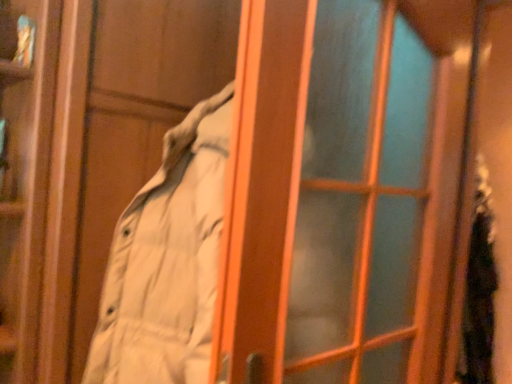
At what (x,y) coordinates should I click in order to perform the action: click on translucent glass screen door at center. Please return your answer as a coordinate pair (x, y). This screenshot has height=384, width=512. Looking at the image, I should click on (343, 190).

The width and height of the screenshot is (512, 384). Describe the element at coordinates (343, 190) in the screenshot. I see `translucent glass screen door at center` at that location.

The width and height of the screenshot is (512, 384). What do you see at coordinates (479, 290) in the screenshot?
I see `fuzzy black scarf at right` at bounding box center [479, 290].

Image resolution: width=512 pixels, height=384 pixels. Find the location of `fuzzy black scarf at right`. fuzzy black scarf at right is located at coordinates (479, 290).

What is the approximate width of fuzzy black scarf at right?

It is 6.08 inches.

Where is `translucent glass screen door at center`? translucent glass screen door at center is located at coordinates (343, 190).

Visually, is translucent glass screen door at center positioned to the left or to the right of fuzzy black scarf at right?

translucent glass screen door at center is to the left of fuzzy black scarf at right.

Is translucent glass screen door at center positioned before fuzzy black scarf at right?

Yes, it is in front of fuzzy black scarf at right.

Does point (360, 268) come behind point (469, 339)?

No, (360, 268) is closer to viewer.

From the image's perspective, which one is positioned higher, translucent glass screen door at center or fuzzy black scarf at right?

translucent glass screen door at center.

From a real-world perspective, between translucent glass screen door at center and fuzzy black scarf at right, who is vertically higher?

From a 3D spatial view, translucent glass screen door at center is above.

Considering the sizes of translucent glass screen door at center and fuzzy black scarf at right in the image, is translucent glass screen door at center wider or thinner than fuzzy black scarf at right?

Considering their sizes, translucent glass screen door at center looks slimmer than fuzzy black scarf at right.

From the picture: From their relative heights in the image, would you say translucent glass screen door at center is taller or shorter than fuzzy black scarf at right?

translucent glass screen door at center is shorter than fuzzy black scarf at right.

Is translucent glass screen door at center smaller than fuzzy black scarf at right?

No, translucent glass screen door at center is not smaller than fuzzy black scarf at right.

Would you say fuzzy black scarf at right is part of translucent glass screen door at center's contents?

No, fuzzy black scarf at right is located outside of translucent glass screen door at center.

Would you consider translucent glass screen door at center to be distant from fuzzy black scarf at right?

Yes.

Is translucent glass screen door at center looking in the opposite direction of fuzzy black scarf at right?

That's not correct — translucent glass screen door at center is not looking away from fuzzy black scarf at right.

How many degrees apart are the facing directions of translucent glass screen door at center and fuzzy black scarf at right?

The angle between the facing direction of translucent glass screen door at center and the facing direction of fuzzy black scarf at right is 87.7 degrees.

Locate an element on the screen. person below the translucent glass screen door at center (from the image's perspective) is located at coordinates (479, 290).

Can you confirm if fuzzy black scarf at right is positioned to the left of translucent glass screen door at center?

No, fuzzy black scarf at right is not to the left of translucent glass screen door at center.

Considering their positions, is fuzzy black scarf at right located in front of or behind translucent glass screen door at center?

fuzzy black scarf at right is behind translucent glass screen door at center.

Which is in front, point (461, 382) or point (293, 55)?

Positioned in front is point (293, 55).

From the image's perspective, which one is positioned lower, fuzzy black scarf at right or translucent glass screen door at center?

fuzzy black scarf at right appears lower in the image.

From a real-world perspective, is fuzzy black scarf at right located higher than translucent glass screen door at center?

No.

Does fuzzy black scarf at right have a lesser width compared to translucent glass screen door at center?

In fact, fuzzy black scarf at right might be wider than translucent glass screen door at center.

Looking at this image, in terms of height, does fuzzy black scarf at right look taller or shorter compared to translucent glass screen door at center?

fuzzy black scarf at right is taller than translucent glass screen door at center.

Which of these two, fuzzy black scarf at right or translucent glass screen door at center, is bigger?

translucent glass screen door at center is bigger.

Does fuzzy black scarf at right contain translucent glass screen door at center?

Definitely not — translucent glass screen door at center is not inside fuzzy black scarf at right.

Is fuzzy black scarf at right not close to translucent glass screen door at center?

Yes, fuzzy black scarf at right and translucent glass screen door at center are quite far apart.

Could you tell me if fuzzy black scarf at right is facing translucent glass screen door at center?

No, fuzzy black scarf at right is not facing towards translucent glass screen door at center.

I want to click on screen door above the fuzzy black scarf at right (from the image's perspective), so click(343, 190).

Locate an element on the screen. Image resolution: width=512 pixels, height=384 pixels. person that is behind the translucent glass screen door at center is located at coordinates (479, 290).

Find the location of a particular element. The image size is (512, 384). screen door on the left of fuzzy black scarf at right is located at coordinates (343, 190).